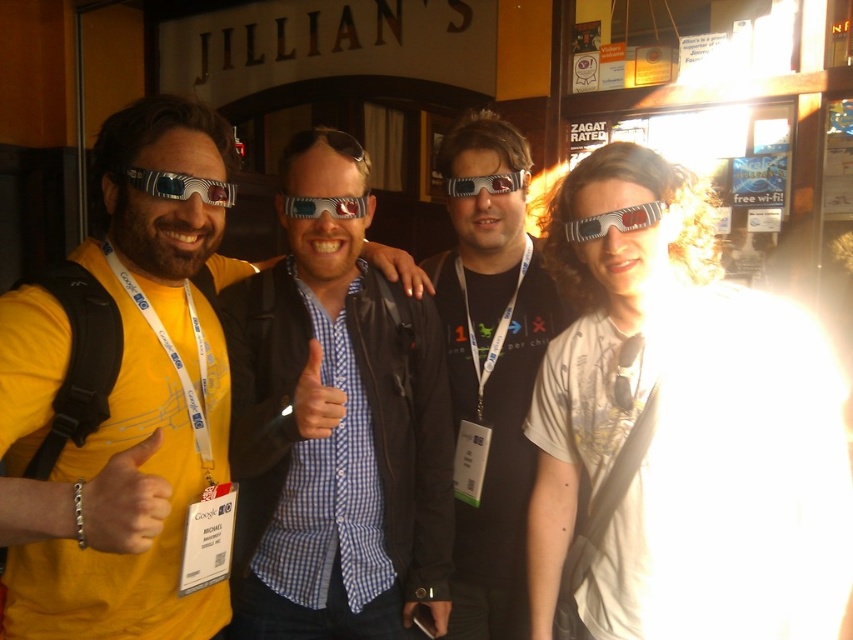
Does white matte sunglasses at center have a smaller size compared to yellow matte t-shirt at center?

Incorrect, white matte sunglasses at center is not smaller in size than yellow matte t-shirt at center.

Is white matte sunglasses at center thinner than yellow matte t-shirt at center?

No, white matte sunglasses at center is not thinner than yellow matte t-shirt at center.

Is point (782, 544) closer to viewer compared to point (48, 410)?

No, (782, 544) is further to viewer.

The image size is (853, 640). In order to click on white matte sunglasses at center in this screenshot , I will do `click(680, 433)`.

Is white matte sunglasses at center below checkered fabric shirt at center?

Incorrect, white matte sunglasses at center is not positioned below checkered fabric shirt at center.

Can you confirm if white matte sunglasses at center is taller than checkered fabric shirt at center?

In fact, white matte sunglasses at center may be shorter than checkered fabric shirt at center.

Is point (775, 595) farther from camera compared to point (277, 541)?

No.

Locate an element on the screen. The image size is (853, 640). white matte sunglasses at center is located at coordinates (680, 433).

What do you see at coordinates (680, 433) in the screenshot?
I see `white matte sunglasses at center` at bounding box center [680, 433].

Does white matte sunglasses at center have a lesser height compared to matte plastic goggles at upper right?

No.

Measure the distance between point (579,358) and camera.

Point (579,358) is 5.50 feet away from camera.

Where is `white matte sunglasses at center`? white matte sunglasses at center is located at coordinates (680, 433).